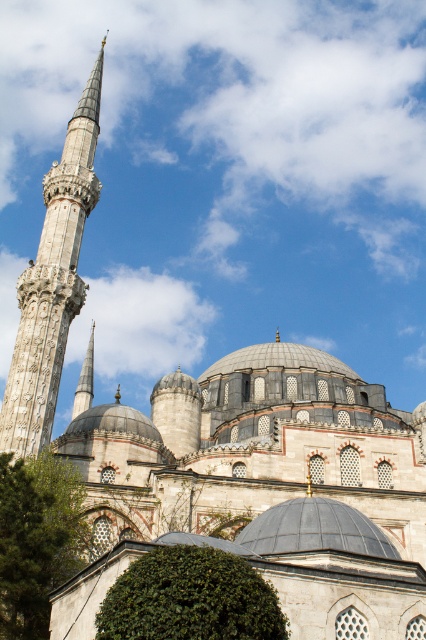
Does gray stone minaret at left have a lesser height compared to polished silver spire at left?

In fact, gray stone minaret at left may be taller than polished silver spire at left.

Identify the location of gray stone minaret at left. The width and height of the screenshot is (426, 640). (52, 282).

I want to click on gray stone minaret at left, so point(52,282).

Find the location of a particular element. Image resolution: width=426 pixels, height=640 pixels. gray stone minaret at left is located at coordinates (52, 282).